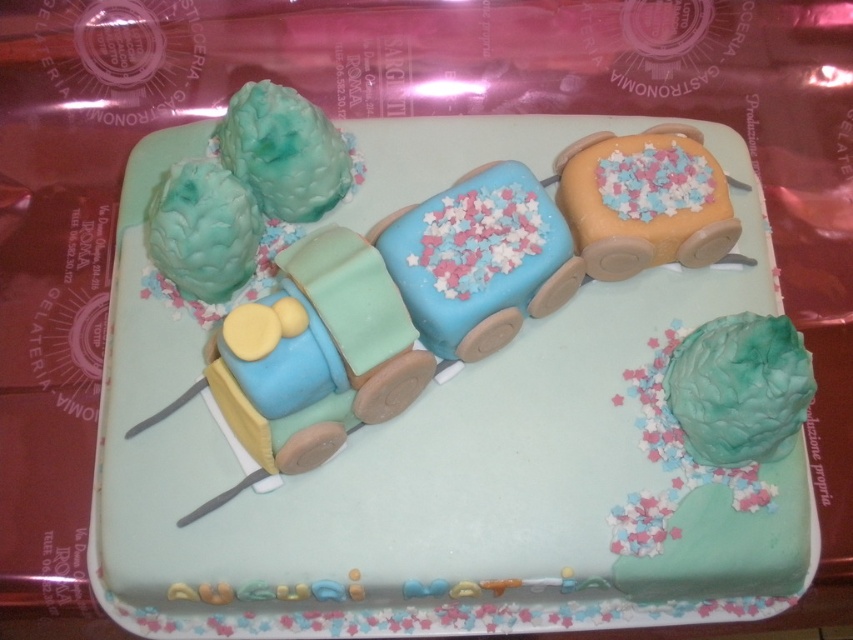
Is matte fondant train at center positioned in front of orange frosted train car at upper right?

Yes, matte fondant train at center is in front of orange frosted train car at upper right.

Does matte fondant train at center have a lesser width compared to orange frosted train car at upper right?

In fact, matte fondant train at center might be wider than orange frosted train car at upper right.

The height and width of the screenshot is (640, 853). Find the location of `matte fondant train at center`. matte fondant train at center is located at coordinates (442, 413).

Which is in front, point (447, 470) or point (445, 221)?

Positioned in front is point (445, 221).

Between matte fondant train at center and blue fondant train at center, which one has less height?

With less height is blue fondant train at center.

The width and height of the screenshot is (853, 640). Identify the location of matte fondant train at center. (442, 413).

Who is more distant from viewer, (480, 180) or (680, 243)?

The point (680, 243) is behind.

Does blue fondant train at center have a lesser height compared to orange frosted train car at upper right?

No.

Is point (517, 163) behind point (682, 138)?

No, it is in front of (682, 138).

Locate an element on the screen. This screenshot has height=640, width=853. blue fondant train at center is located at coordinates (480, 260).